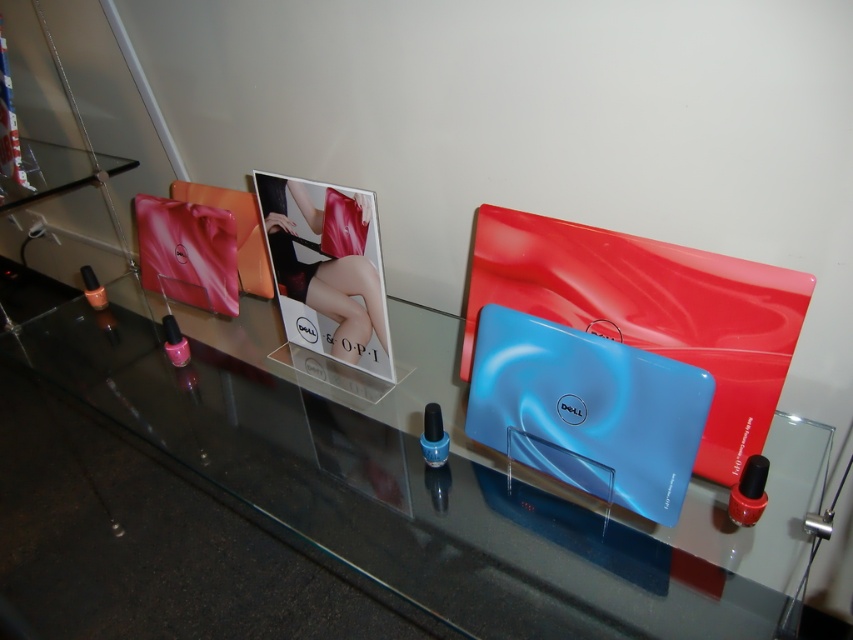
Question: Does shiny glass table at center appear under blue glossy laptop at center?

Choices:
 (A) yes
 (B) no

Answer: (A)

Question: Which object appears closest to the camera in this image?

Choices:
 (A) satin red dress at center
 (B) blue glossy laptop at center

Answer: (B)

Question: Is shiny glass table at center thinner than satin red dress at center?

Choices:
 (A) no
 (B) yes

Answer: (A)

Question: Which object appears farthest from the camera in this image?

Choices:
 (A) shiny glass table at center
 (B) satin red dress at center

Answer: (A)

Question: Which point is closer to the camera?

Choices:
 (A) (326, 337)
 (B) (531, 445)
 (C) (292, 541)

Answer: (B)

Question: Is shiny glass table at center to the right of blue glossy laptop at center from the viewer's perspective?

Choices:
 (A) yes
 (B) no

Answer: (B)